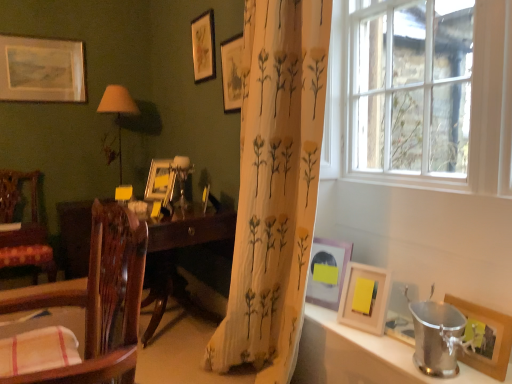
Where is `free space in front of wooden picture frame at lower right, positioned as the second picture frame in front-to-back order`? The image size is (512, 384). free space in front of wooden picture frame at lower right, positioned as the second picture frame in front-to-back order is located at coordinates (370, 337).